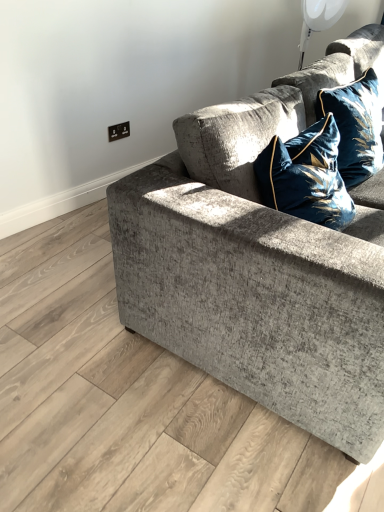
Question: From the image's perspective, is textured gray couch at center above or below velvet blue pillow at upper right?

Choices:
 (A) below
 (B) above

Answer: (A)

Question: Based on their positions, is textured gray couch at center located to the left or right of velvet blue pillow at upper right?

Choices:
 (A) right
 (B) left

Answer: (A)

Question: From their relative heights in the image, would you say textured gray couch at center is taller or shorter than velvet blue pillow at upper right?

Choices:
 (A) short
 (B) tall

Answer: (B)

Question: From a real-world perspective, relative to textured gray couch at center, is velvet blue pillow at upper right vertically above or below?

Choices:
 (A) above
 (B) below

Answer: (A)

Question: Considering the positions of point (354, 167) and point (213, 296), is point (354, 167) closer or farther from the camera than point (213, 296)?

Choices:
 (A) farther
 (B) closer

Answer: (A)

Question: Relative to textured gray couch at center, is velvet blue pillow at upper right in front or behind?

Choices:
 (A) behind
 (B) front

Answer: (A)

Question: Considering the positions of velvet blue pillow at upper right and textured gray couch at center in the image, is velvet blue pillow at upper right wider or thinner than textured gray couch at center?

Choices:
 (A) thin
 (B) wide

Answer: (A)